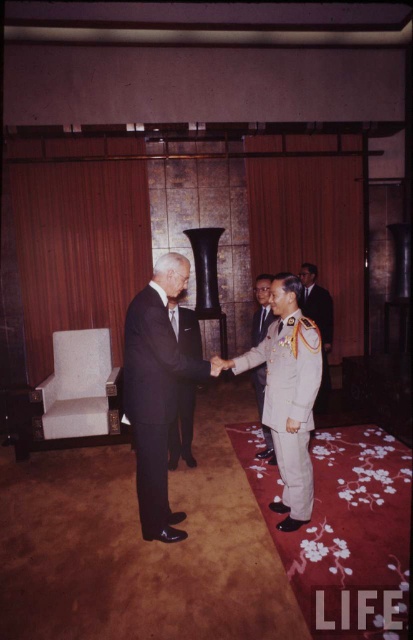
You are standing in the meeting room and want to move from the point closer to you to the farther point. Which path should you take to go from the point at coordinates point (178, 378) to the point at coordinates point (311, 276)?

You should move from the point at coordinates point (178, 378) to the point at coordinates point (311, 276) by going towards the upper left direction since point (178, 378) is closer to the viewer and point (311, 276) is farther away.

You are an event organizer planning to seat two officials wearing the khaki fabric uniform at center and the light gray uniform at center. Which official should you assign a larger chair to?

The khaki fabric uniform at center is bigger than the light gray uniform at center, so the official in the khaki fabric uniform at center should be given a larger chair to accommodate their size.

You are an event planner arranging seating for a formal event. You need to place a chair for the matte black suit at center and another chair for the light gray uniform at center. Which chair requires a larger area to accommodate the occupant?

The light gray uniform at center requires a larger chair because it occupies more space than the matte black suit at center according to the description.